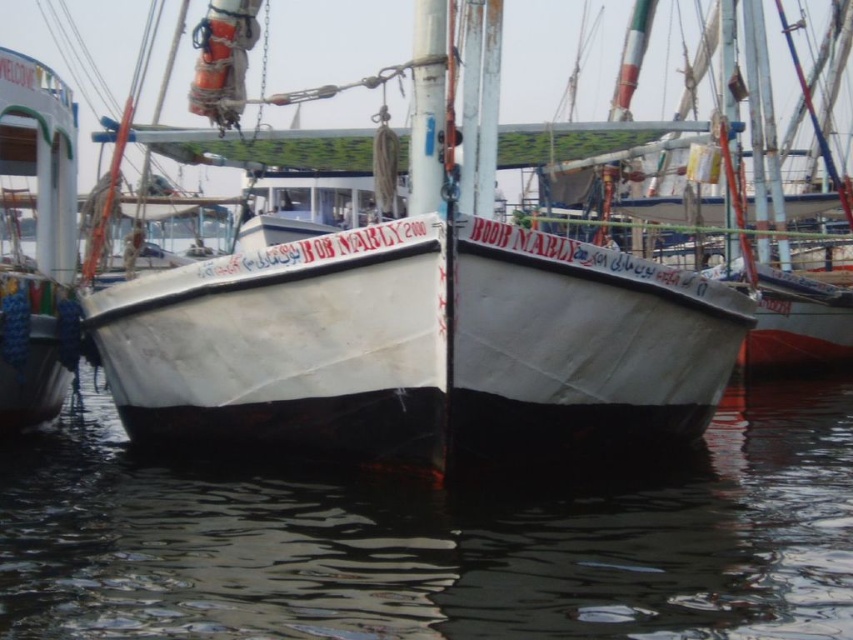
Is black rubber water at center below white matte boat at left?

Correct, black rubber water at center is located below white matte boat at left.

Which is behind, point (809, 436) or point (53, 324)?

The point (809, 436) is more distant.

I want to click on black rubber water at center, so click(x=437, y=540).

Is point (277, 412) positioned behind point (39, 179)?

No.

Who is more forward, (289,344) or (18,220)?

Point (289,344)

Does point (521, 340) come in front of point (38, 352)?

Yes, point (521, 340) is closer to viewer.

Locate an element on the screen. This screenshot has height=640, width=853. white matte boat at center is located at coordinates (427, 323).

Is black rubber water at center positioned in front of white matte boat at center?

Yes, black rubber water at center is in front of white matte boat at center.

Can you confirm if black rubber water at center is shorter than white matte boat at center?

Indeed, black rubber water at center has a lesser height compared to white matte boat at center.

Does point (85, 612) come in front of point (473, 374)?

Yes, point (85, 612) is in front of point (473, 374).

The image size is (853, 640). What are the coordinates of `black rubber water at center` in the screenshot? It's located at (437, 540).